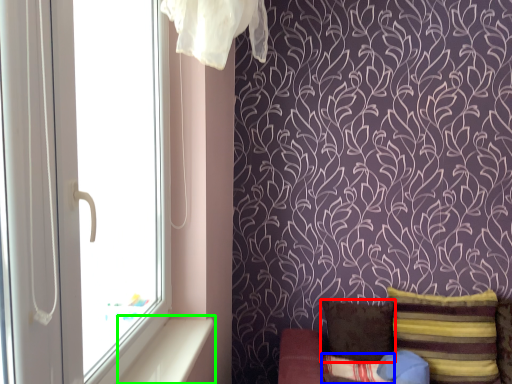
Question: Which object is positioned closest to pillow (highlighted by a red box)? Select from pillow (highlighted by a blue box) and window sill (highlighted by a green box).

Choices:
 (A) pillow
 (B) window sill

Answer: (A)